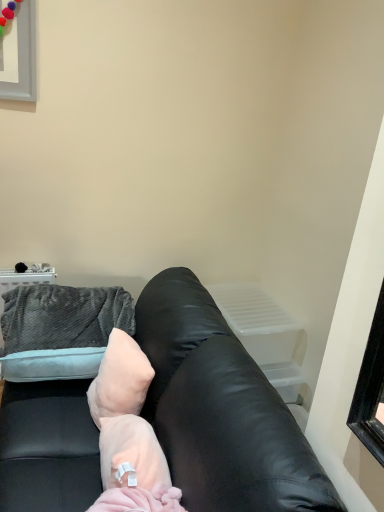
Question: Choose the correct answer: Is pale pink plush pillow at center inside black leather couch at center or outside it?

Choices:
 (A) inside
 (B) outside

Answer: (A)

Question: From the image's perspective, is pale pink plush pillow at center positioned above or below black leather couch at center?

Choices:
 (A) above
 (B) below

Answer: (A)

Question: Based on their relative distances, which object is farther from the velvety gray throw pillow at upper left?

Choices:
 (A) pale pink plush pillow at center
 (B) pink fluffy blanket at center
 (C) black leather couch at center

Answer: (C)

Question: Based on their relative distances, which object is farther from the velvety gray throw pillow at upper left?

Choices:
 (A) pink fluffy blanket at center
 (B) black leather couch at center
 (C) pale pink plush pillow at center

Answer: (B)